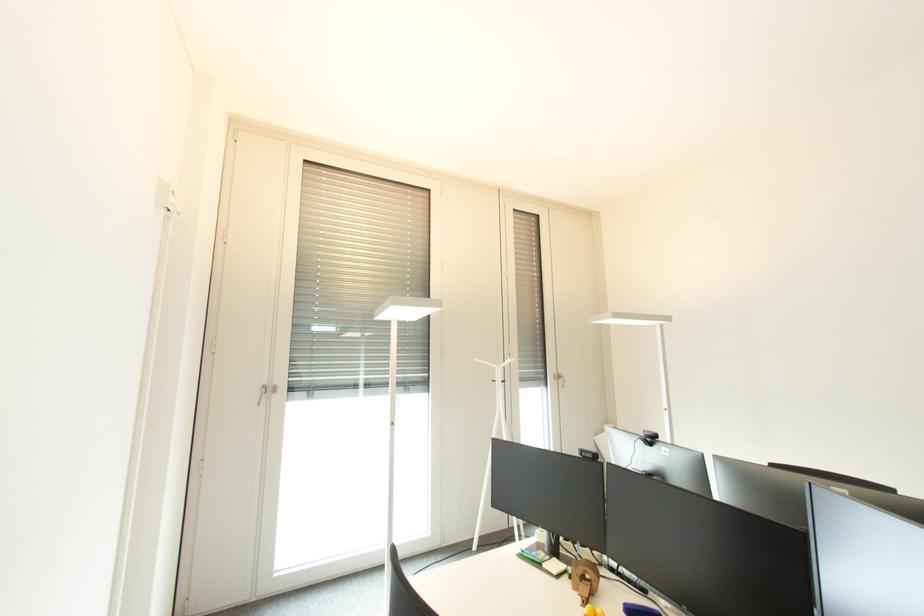
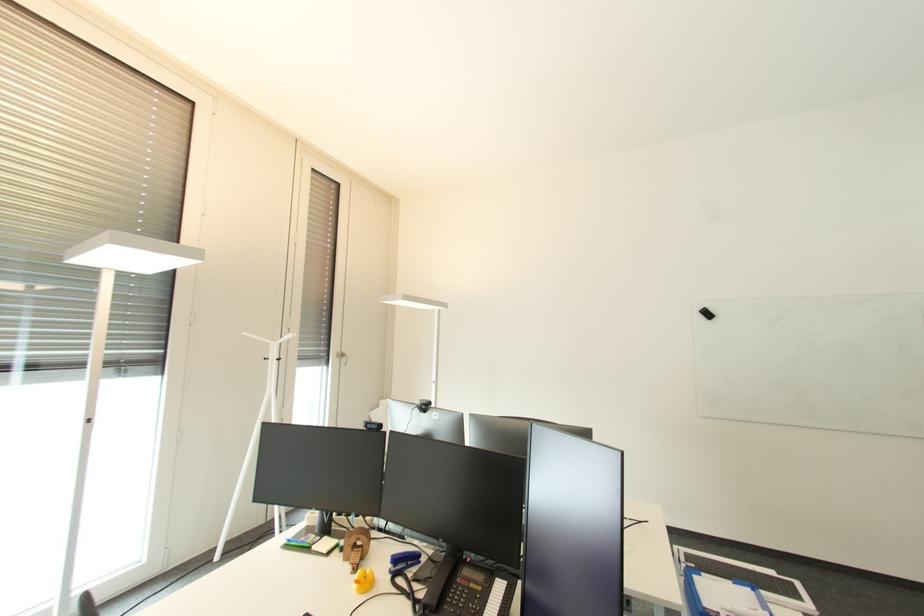
Question: The camera is either moving clockwise (left) or counter-clockwise (right) around the object. The first image is from the beginning of the video and the second image is from the end. Is the camera moving left or right when shooting the video?

Choices:
 (A) Left
 (B) Right

Answer: (A)